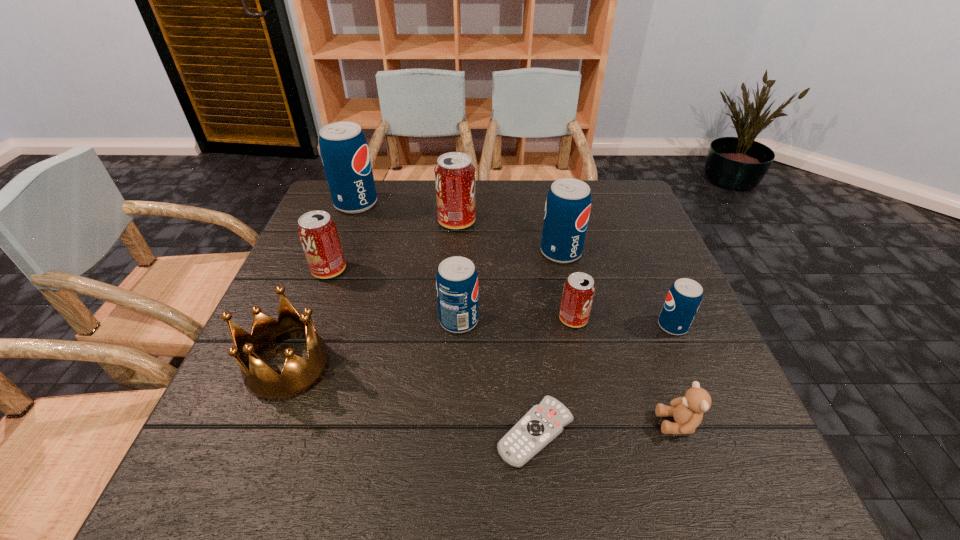
I want to click on the fourth closest pop to the crown, so click(x=344, y=150).

Where is `blue pop that is the third nearest to the second farthest red soda can`? Image resolution: width=960 pixels, height=540 pixels. blue pop that is the third nearest to the second farthest red soda can is located at coordinates (567, 209).

At what (x,y) coordinates should I click in order to perform the action: click on blue pop that is the closest to the tallest object. Please return your answer as a coordinate pair (x, y). Looking at the image, I should click on (456, 279).

Identify the location of red soda can that is the third closest to the second shortest object. This screenshot has width=960, height=540. (317, 231).

You are a GUI agent. You are given a task and a screenshot of the screen. Output one action in this format:
    pyautogui.click(x=<x>, y=<y>)
    Task: Click on the red soda can that is the third closest to the second blue pop from left to right
    The height and width of the screenshot is (540, 960).
    Given the screenshot: What is the action you would take?
    pyautogui.click(x=454, y=173)

Find the location of a particular element. The height and width of the screenshot is (540, 960). free location that satisfies the following two spatial constraints: 1. on the front side of the second biggest blue pop; 2. on the right side of the rightmost blue pop is located at coordinates (577, 326).

In order to click on free space that satisfies the following two spatial constraints: 1. on the front side of the tallest object; 2. on the left side of the second biggest blue pop in this screenshot , I will do `click(338, 252)`.